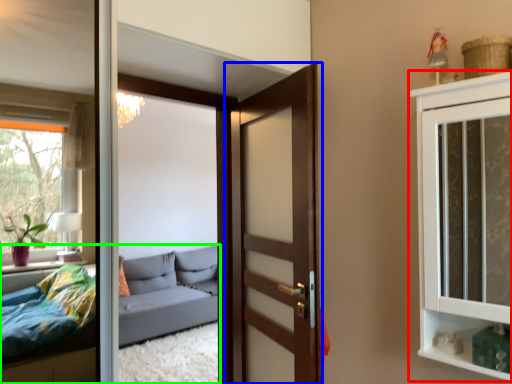
Question: Considering the real-world distances, which object is closest to cabinetry (highlighted by a red box)? door (highlighted by a blue box) or studio couch (highlighted by a green box).

Choices:
 (A) door
 (B) studio couch

Answer: (A)